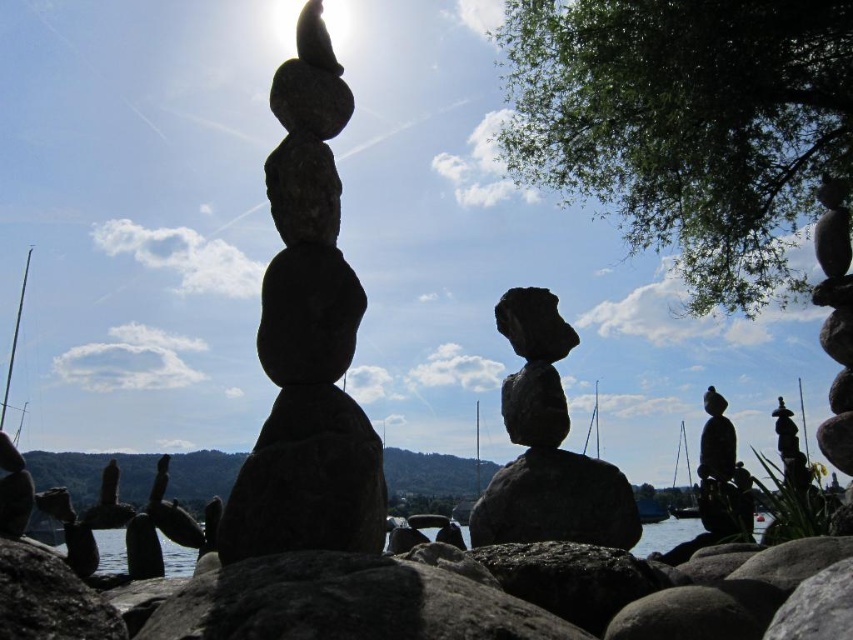
You are a photographer planning to take a photo of the smooth gray rock stack at center and the rough stone stack at center. Which stack will appear larger in the photo?

The smooth gray rock stack at center will appear larger in the photo because it is closer to the camera than the rough stone stack at center.

You are planning to place a decorative item on the lakeside. The item requires a surface wider than the smooth gray rock stack at center. Can the transparent water at center provide a suitable surface for this item?

The smooth gray rock stack at center is narrower than the transparent water at center, so the transparent water at center has a wider surface and can accommodate the decorative item.

You are standing at the lakeside and see the smooth gray rock stack at center and the transparent water at center. Which object is positioned to the left when viewed from your perspective?

The smooth gray rock stack at center is to the left of the transparent water at center.